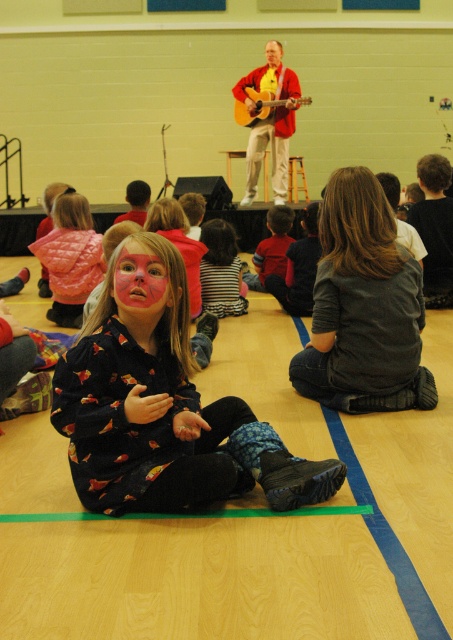
You are a photographer standing in the gymnasium and want to take a closeup photo of the pink matte face paint at center. The camera you have can focus on subjects within 2 meters. Will you be able to take the photo without moving closer?

The pink matte face paint at center and the viewer are 2.37 meters apart from each other. Since the camera can only focus within 2 meters, you need to move closer to take the photo.

You are a photographer trying to capture a closeup shot of the pink matte face paint at center and the acoustic wood guitar at upper center. Since you want both objects in focus, you need to know their relative sizes. Which object is smaller?

The pink matte face paint at center is not as tall as the acoustic wood guitar at upper center, so the pink matte face paint at center is smaller.

In the scene, there is a printed fabric dress at center and an acoustic wood guitar at upper center. Which object is positioned to the left of the other?

The printed fabric dress at center is to the left of the acoustic wood guitar at upper center.